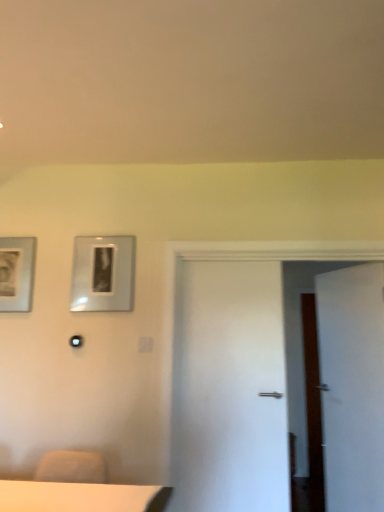
Question: Is matte silver picture frame at left, the second picture frame viewed from the right, located outside white matte door at right?

Choices:
 (A) no
 (B) yes

Answer: (B)

Question: Considering the relative sizes of matte silver picture frame at left, placed as the 1th picture frame when sorted from left to right, and white matte door at right in the image provided, is matte silver picture frame at left, placed as the 1th picture frame when sorted from left to right, wider than white matte door at right?

Choices:
 (A) no
 (B) yes

Answer: (A)

Question: Is matte silver picture frame at left, the second picture frame viewed from the right, at the left side of white matte door at right?

Choices:
 (A) no
 (B) yes

Answer: (B)

Question: From the image's perspective, would you say matte silver picture frame at left, placed as the 1th picture frame when sorted from left to right, is positioned over white matte door at right?

Choices:
 (A) yes
 (B) no

Answer: (A)

Question: Is there a large distance between matte silver picture frame at left, the second picture frame viewed from the right, and white matte door at right?

Choices:
 (A) no
 (B) yes

Answer: (B)

Question: Can you confirm if matte silver picture frame at left, placed as the 1th picture frame when sorted from left to right, is shorter than white matte door at right?

Choices:
 (A) yes
 (B) no

Answer: (A)

Question: Considering the relative positions of metallic silver picture frame at upper left, the second picture frame positioned from the left, and white matte door at right in the image provided, is metallic silver picture frame at upper left, the second picture frame positioned from the left, behind white matte door at right?

Choices:
 (A) no
 (B) yes

Answer: (B)

Question: Is metallic silver picture frame at upper left, the second picture frame positioned from the left, outside of white matte door at right?

Choices:
 (A) yes
 (B) no

Answer: (A)

Question: Does metallic silver picture frame at upper left, the first picture frame from the right, lie in front of white matte door at right?

Choices:
 (A) no
 (B) yes

Answer: (A)

Question: Is metallic silver picture frame at upper left, the first picture frame from the right, to the left of white matte door at right from the viewer's perspective?

Choices:
 (A) no
 (B) yes

Answer: (B)

Question: Is metallic silver picture frame at upper left, the second picture frame positioned from the left, turned away from white matte door at right?

Choices:
 (A) no
 (B) yes

Answer: (A)

Question: Does metallic silver picture frame at upper left, the first picture frame from the right, have a smaller size compared to white matte door at right?

Choices:
 (A) no
 (B) yes

Answer: (B)

Question: Is matte silver picture frame at left, the second picture frame viewed from the right, further to camera compared to metallic silver picture frame at upper left, the first picture frame from the right?

Choices:
 (A) no
 (B) yes

Answer: (B)